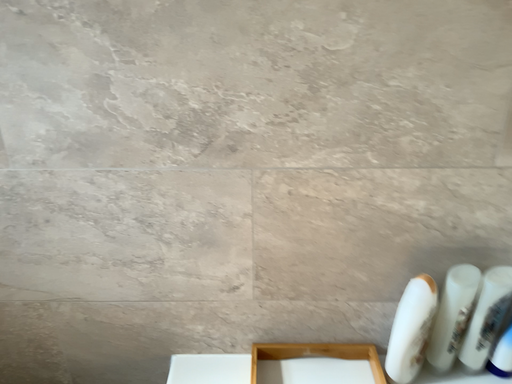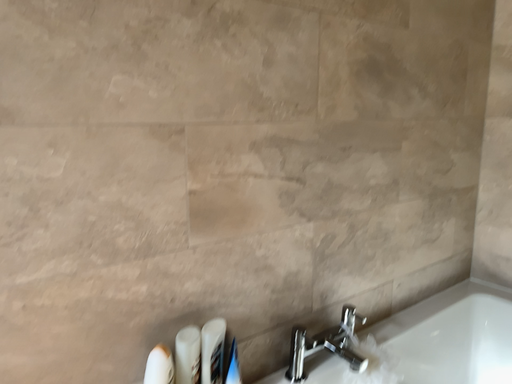
Question: Which way did the camera rotate in the video?

Choices:
 (A) rotated left
 (B) rotated right

Answer: (B)